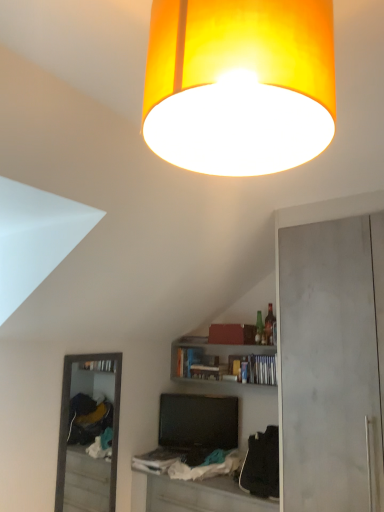
Question: Should I look upward or downward to see wooden bookshelf at center?

Choices:
 (A) down
 (B) up

Answer: (A)

Question: From a real-world perspective, is wooden bookshelf at center below orange fabric lampshade at upper center?

Choices:
 (A) no
 (B) yes

Answer: (B)

Question: Considering the relative positions of wooden bookshelf at center and orange fabric lampshade at upper center in the image provided, is wooden bookshelf at center in front of orange fabric lampshade at upper center?

Choices:
 (A) yes
 (B) no

Answer: (B)

Question: Can you confirm if wooden bookshelf at center is bigger than orange fabric lampshade at upper center?

Choices:
 (A) no
 (B) yes

Answer: (A)

Question: Considering the relative sizes of wooden bookshelf at center and orange fabric lampshade at upper center in the image provided, is wooden bookshelf at center shorter than orange fabric lampshade at upper center?

Choices:
 (A) no
 (B) yes

Answer: (B)

Question: Is the position of wooden bookshelf at center more distant than that of orange fabric lampshade at upper center?

Choices:
 (A) no
 (B) yes

Answer: (B)

Question: From the image's perspective, would you say wooden bookshelf at center is positioned over orange fabric lampshade at upper center?

Choices:
 (A) yes
 (B) no

Answer: (B)

Question: From the image's perspective, is black glossy television at center on top of white fabric table at lower center?

Choices:
 (A) yes
 (B) no

Answer: (A)

Question: Is black glossy television at center at the left side of white fabric table at lower center?

Choices:
 (A) yes
 (B) no

Answer: (A)

Question: Can you confirm if black glossy television at center is smaller than white fabric table at lower center?

Choices:
 (A) no
 (B) yes

Answer: (B)

Question: From the image's perspective, is black glossy television at center below white fabric table at lower center?

Choices:
 (A) yes
 (B) no

Answer: (B)

Question: Is black glossy television at center behind white fabric table at lower center?

Choices:
 (A) yes
 (B) no

Answer: (A)

Question: Does black glossy television at center have a larger size compared to white fabric table at lower center?

Choices:
 (A) yes
 (B) no

Answer: (B)

Question: Does black glossy television at center have a larger size compared to orange fabric lampshade at upper center?

Choices:
 (A) no
 (B) yes

Answer: (A)